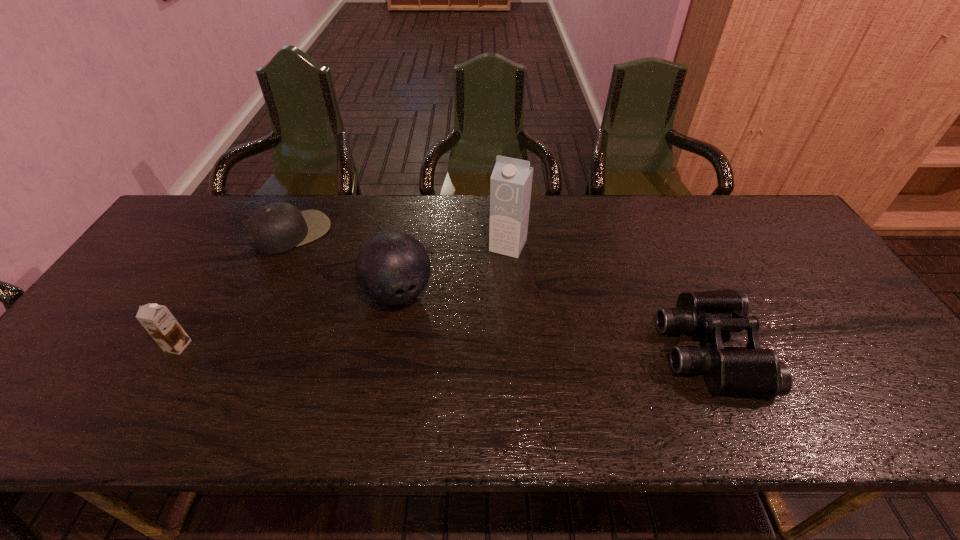
Locate an element on the screen. This screenshot has height=540, width=960. vacant spot on the desktop that is between the leftmost object and the binoculars and is positioned on the grip area of the bowling ball is located at coordinates (427, 347).

The width and height of the screenshot is (960, 540). I want to click on vacant spot on the desktop that is between the chocolate milk and the rightmost object and is positioned on the brim of the cap, so pos(392,347).

Locate an element on the screen. The height and width of the screenshot is (540, 960). vacant space on the desktop that is between the leftmost object and the binoculars and is positioned on the front label of the carton is located at coordinates (457, 348).